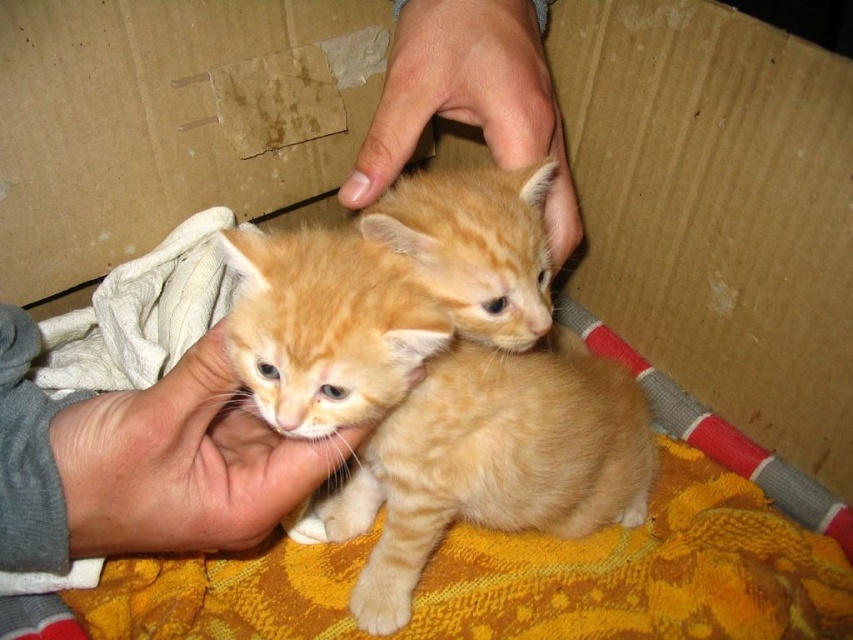
Is orange fur kittens at center bigger than orange tabby kitten at center?

Incorrect, orange fur kittens at center is not larger than orange tabby kitten at center.

Does orange fur kittens at center have a greater width compared to orange tabby kitten at center?

Incorrect, orange fur kittens at center's width does not surpass orange tabby kitten at center's.

What are the coordinates of `orange fur kittens at center` in the screenshot? It's located at (387, 292).

In order to click on orange fur kittens at center in this screenshot , I will do `click(387, 292)`.

Measure the distance from orange fur kittens at center to smooth skin hand at upper center.

orange fur kittens at center and smooth skin hand at upper center are 5.40 inches apart from each other.

From the picture: Does orange fur kittens at center lie behind smooth skin hand at upper center?

That is False.

Between point (473, 324) and point (494, 109), which one is positioned in front?

Point (473, 324) is more forward.

Find the location of a particular element. The image size is (853, 640). orange fur kittens at center is located at coordinates (387, 292).

Can you confirm if orange fur kittens at center is positioned to the left of flesh-toned skin at center?

No, orange fur kittens at center is not to the left of flesh-toned skin at center.

Is the position of orange fur kittens at center more distant than that of flesh-toned skin at center?

That is False.

Which is in front, point (280, 324) or point (213, 474)?

Point (280, 324) is in front.

Find the location of a particular element. orange fur kittens at center is located at coordinates (387, 292).